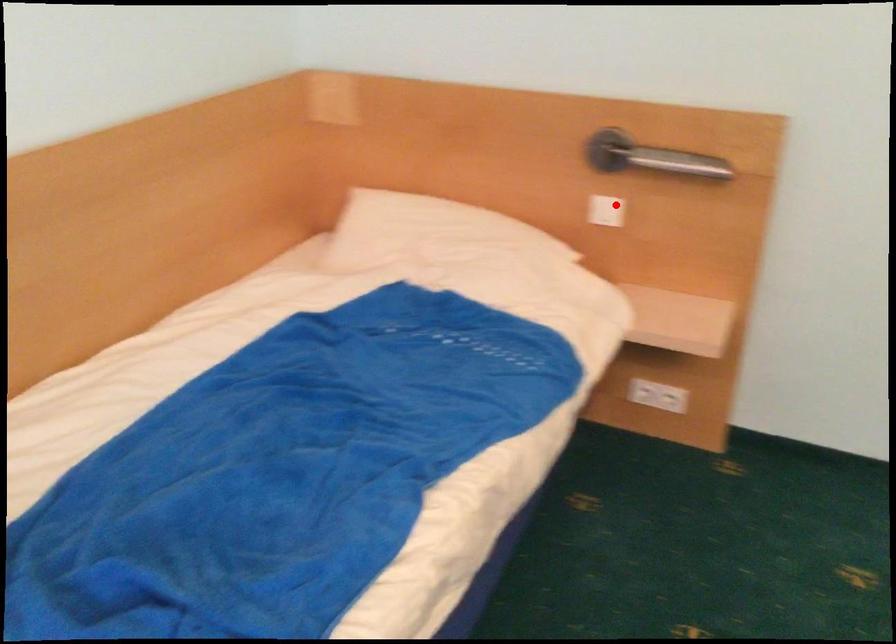
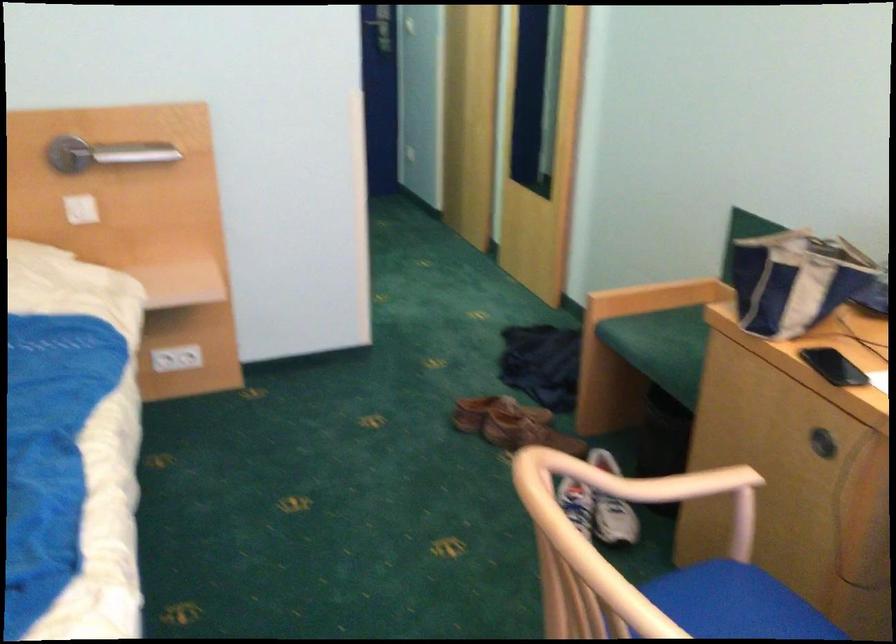
Locate, in the second image, the point that corresponds to the highlighted location in the first image.

(81, 209)